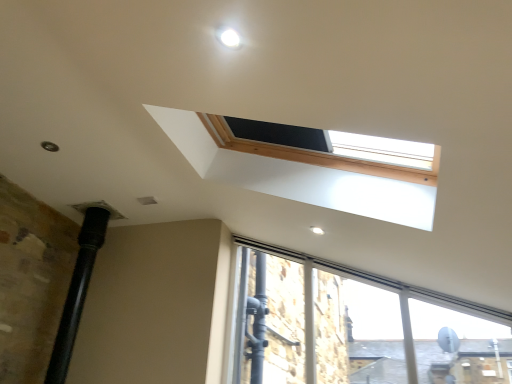
What is the approximate width of transparent glass window at upper center?

transparent glass window at upper center is 4.89 inches in width.

Image resolution: width=512 pixels, height=384 pixels. I want to click on transparent glass window at upper center, so click(355, 327).

What do you see at coordinates (355, 327) in the screenshot? This screenshot has height=384, width=512. I see `transparent glass window at upper center` at bounding box center [355, 327].

Measure the distance between point [281,254] and camera.

The depth of point [281,254] is 3.37 meters.

Identify the location of transparent glass window at upper center. (355, 327).